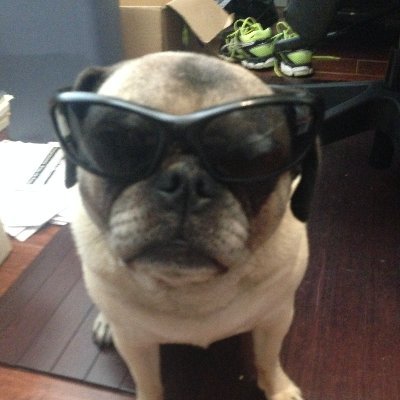
Identify the location of cardboard box. 156,28.